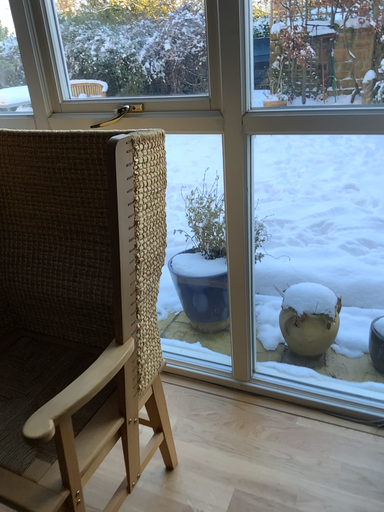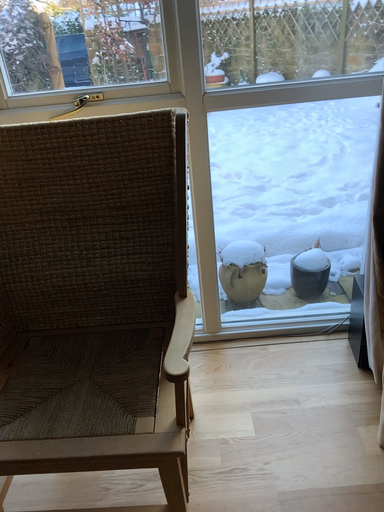
Question: Which way did the camera rotate in the video?

Choices:
 (A) rotated left
 (B) rotated right

Answer: (B)